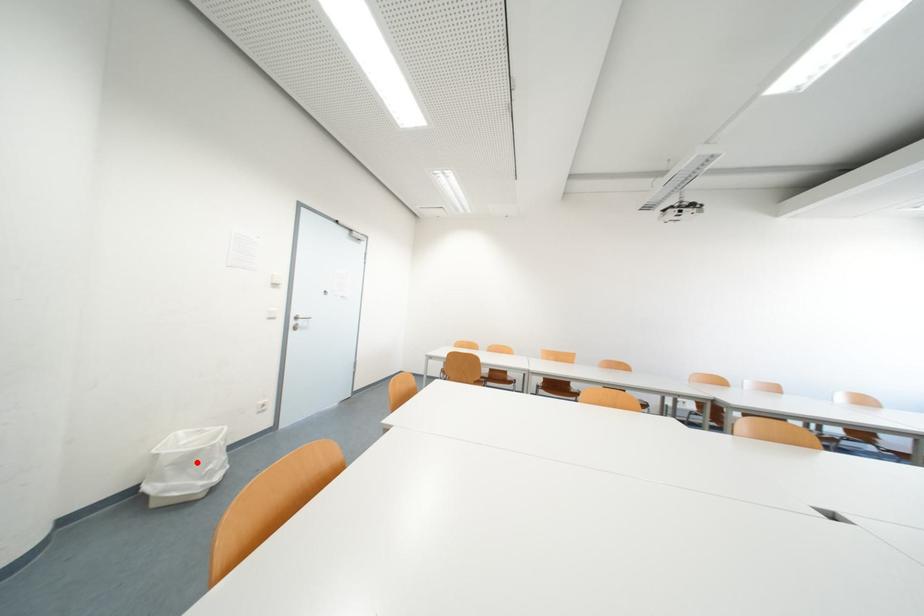
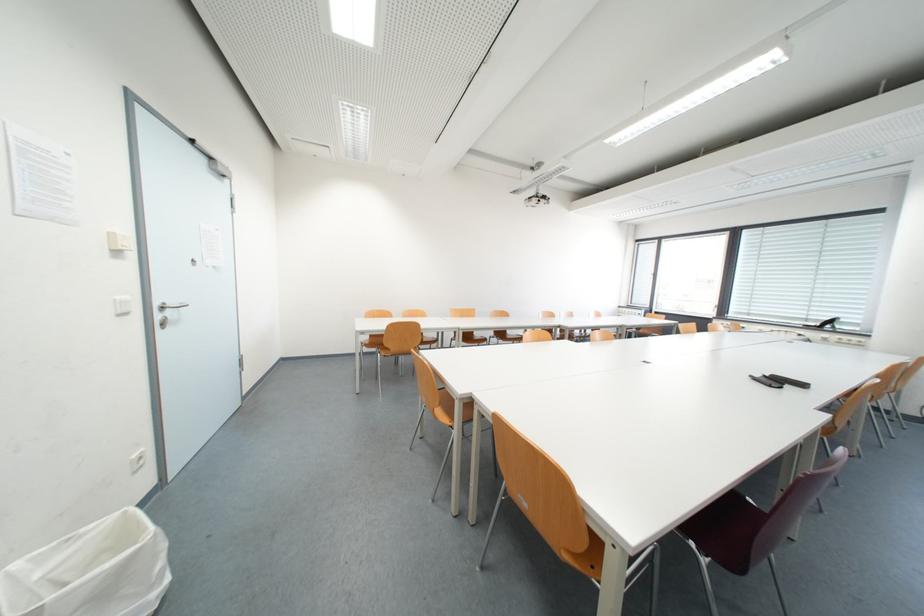
The point at the highlighted location is marked in the first image. Where is the corresponding point in the second image?

(123, 585)